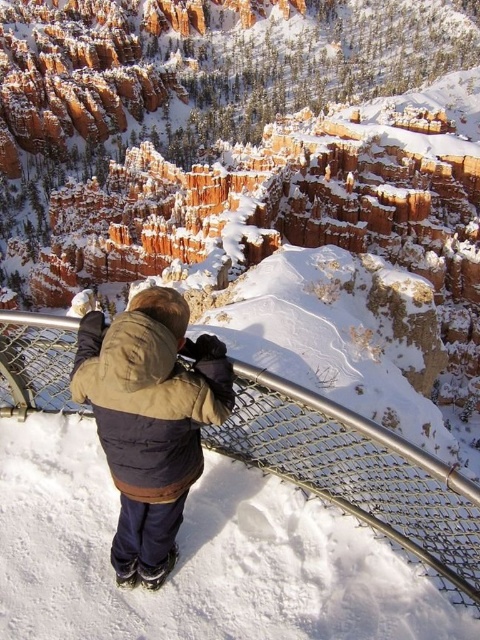
You are a photographer trying to capture the scenic overlook with the metal mesh railing at center and the brown fuzzy jacket at center. Which object should you focus on first to ensure it appears sharp in the foreground?

The metal mesh railing at center should be focused on first because it is closer to the viewer than the brown fuzzy jacket at center, ensuring it remains sharp in the foreground.

You are standing at the overlook and want to take a photo of the brown fuzzy jacket at center while also including the metal mesh railing at center in the frame. Which direction should you move to ensure both are visible?

You should move to the left so that both the brown fuzzy jacket at center and the metal mesh railing at center are visible in the frame since the metal mesh railing at center is to the right of the brown fuzzy jacket at center.